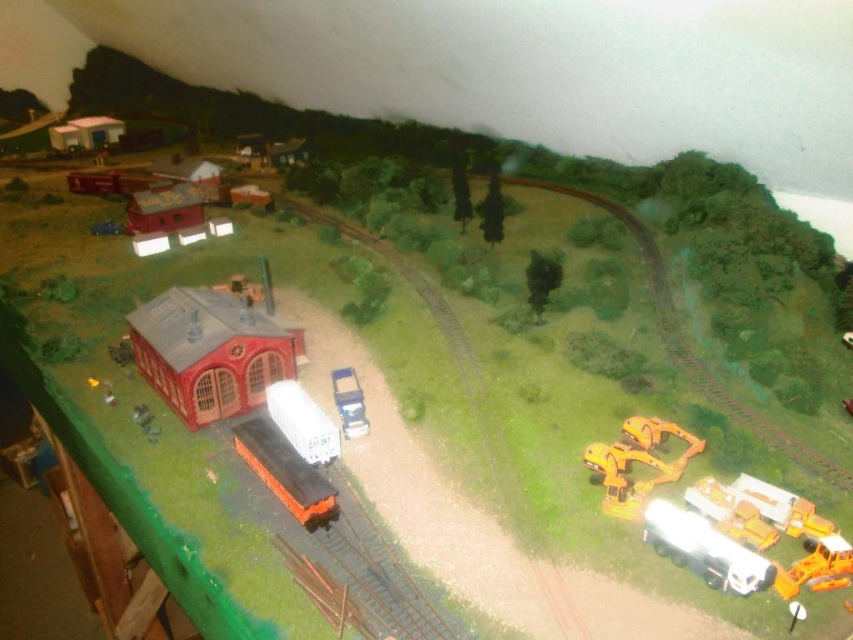
What is located at the coordinates point (283, 470) in the model railway scene?

The point (283, 470) is located on the orange matte train car at center.

Consider the image. You are a model railway enthusiast examining the scene. You notice the orange matte train car at center and the metallic blue truck at center. Which of these two objects has a greater height in this model railway setup?

The orange matte train car at center is much taller than the metallic blue truck at center, so it has a greater height in this model railway setup.